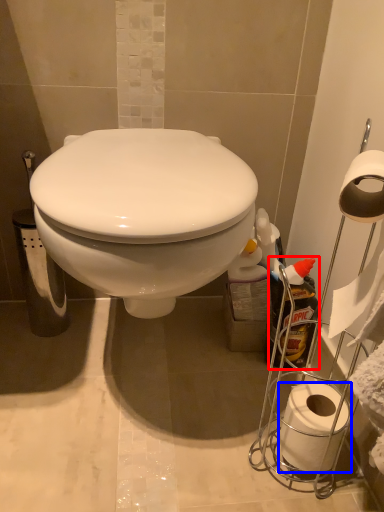
Question: Which point is further to the camera, cleaning product (highlighted by a red box) or toilet paper (highlighted by a blue box)?

Choices:
 (A) cleaning product
 (B) toilet paper

Answer: (A)